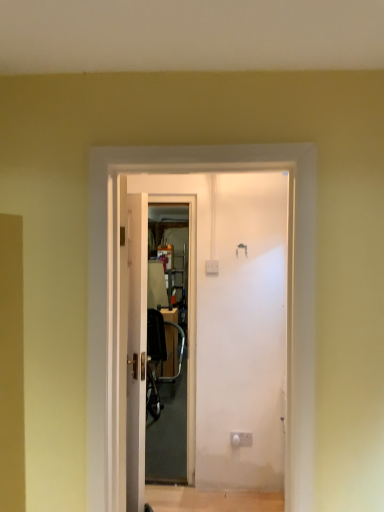
Describe the element at coordinates (171, 356) in the screenshot. I see `transparent plastic screen door at center` at that location.

Describe the element at coordinates (158, 360) in the screenshot. I see `metallic silver chair at center` at that location.

Where is `transparent plastic screen door at center`? This screenshot has height=512, width=384. transparent plastic screen door at center is located at coordinates (171, 356).

In terms of size, does metallic silver chair at center appear bigger or smaller than white glossy door at center?

Clearly, metallic silver chair at center is larger in size than white glossy door at center.

Considering the sizes of metallic silver chair at center and white glossy door at center in the image, is metallic silver chair at center wider or thinner than white glossy door at center?

Clearly, metallic silver chair at center has more width compared to white glossy door at center.

From the picture: Is white glossy door at center a part of metallic silver chair at center?

Actually, white glossy door at center is outside metallic silver chair at center.

Considering the sizes of metallic silver chair at center and white glossy door at center in the image, is metallic silver chair at center taller or shorter than white glossy door at center?

In the image, metallic silver chair at center appears to be shorter than white glossy door at center.

From the image's perspective, who appears lower, white glossy door at center or metallic silver chair at center?

metallic silver chair at center.

Is white glossy door at center bigger than metallic silver chair at center?

Incorrect, white glossy door at center is not larger than metallic silver chair at center.

Which object is wider, white glossy door at center or metallic silver chair at center?

Wider between the two is metallic silver chair at center.

Is transparent plastic screen door at center oriented towards white glossy door at center?

No, transparent plastic screen door at center is not oriented towards white glossy door at center.

Relative to white glossy door at center, is transparent plastic screen door at center in front or behind?

transparent plastic screen door at center is behind white glossy door at center.

Measure the distance from transparent plastic screen door at center to white glossy door at center.

transparent plastic screen door at center is 5.71 feet from white glossy door at center.

Based on the photo, is transparent plastic screen door at center taller than white glossy door at center?

Yes, transparent plastic screen door at center is taller than white glossy door at center.

Can you tell me how much metallic silver chair at center and transparent plastic screen door at center differ in facing direction?

90.8 degrees.

Is metallic silver chair at center positioned behind transparent plastic screen door at center?

Yes, it is behind transparent plastic screen door at center.

Does metallic silver chair at center appear on the right side of transparent plastic screen door at center?

No, metallic silver chair at center is not to the right of transparent plastic screen door at center.

Do you think metallic silver chair at center is within transparent plastic screen door at center, or outside of it?

metallic silver chair at center cannot be found inside transparent plastic screen door at center.

Does transparent plastic screen door at center have a lesser height compared to metallic silver chair at center?

No.

Considering the sizes of transparent plastic screen door at center and metallic silver chair at center in the image, is transparent plastic screen door at center bigger or smaller than metallic silver chair at center?

transparent plastic screen door at center is smaller than metallic silver chair at center.

Which object is further away from the camera taking this photo, transparent plastic screen door at center or metallic silver chair at center?

metallic silver chair at center is behind.

Identify the location of screen door in front of the metallic silver chair at center. (171, 356).

Which object is thinner, white glossy door at center or transparent plastic screen door at center?

white glossy door at center is thinner.

I want to click on door directly beneath the transparent plastic screen door at center (from a real-world perspective), so click(136, 350).

Could transparent plastic screen door at center be considered to be inside white glossy door at center?

No, transparent plastic screen door at center is not a part of white glossy door at center.

Is white glossy door at center far from transparent plastic screen door at center?

white glossy door at center is positioned a significant distance from transparent plastic screen door at center.

Where is `door above the metallic silver chair at center (from the image's perspective)`? This screenshot has width=384, height=512. door above the metallic silver chair at center (from the image's perspective) is located at coordinates [136, 350].

At what (x,y) coordinates should I click in order to perform the action: click on door positioned vertically above the metallic silver chair at center (from a real-world perspective). Please return your answer as a coordinate pair (x, y). Image resolution: width=384 pixels, height=512 pixels. Looking at the image, I should click on (136, 350).

Consider the image. Based on their spatial positions, is white glossy door at center or transparent plastic screen door at center further from metallic silver chair at center?

white glossy door at center is positioned further to the anchor metallic silver chair at center.

Considering their positions, is white glossy door at center positioned further to transparent plastic screen door at center than metallic silver chair at center?

Among the two, white glossy door at center is located further to transparent plastic screen door at center.

Which object lies nearer to the anchor point white glossy door at center, metallic silver chair at center or transparent plastic screen door at center?

The object closer to white glossy door at center is transparent plastic screen door at center.

Which object lies nearer to the anchor point transparent plastic screen door at center, metallic silver chair at center or white glossy door at center?

The object closer to transparent plastic screen door at center is metallic silver chair at center.

From the image, which object appears to be nearer to white glossy door at center, transparent plastic screen door at center or metallic silver chair at center?

Among the two, transparent plastic screen door at center is located nearer to white glossy door at center.

Looking at the image, which one is located further to metallic silver chair at center, transparent plastic screen door at center or white glossy door at center?

white glossy door at center lies further to metallic silver chair at center than the other object.

You are a GUI agent. You are given a task and a screenshot of the screen. Output one action in this format:
    pyautogui.click(x=<x>, y=<y>)
    Task: Click on the screen door positioned between white glossy door at center and metallic silver chair at center from near to far
    
    Given the screenshot: What is the action you would take?
    pyautogui.click(x=171, y=356)